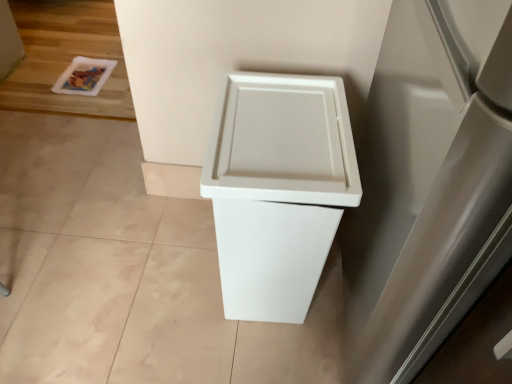
Image resolution: width=512 pixels, height=384 pixels. Identify the location of white plastic waste bin at center. (278, 189).

Describe the element at coordinates (278, 189) in the screenshot. I see `white plastic waste bin at center` at that location.

This screenshot has height=384, width=512. Find the location of `white plastic waste bin at center`. white plastic waste bin at center is located at coordinates (278, 189).